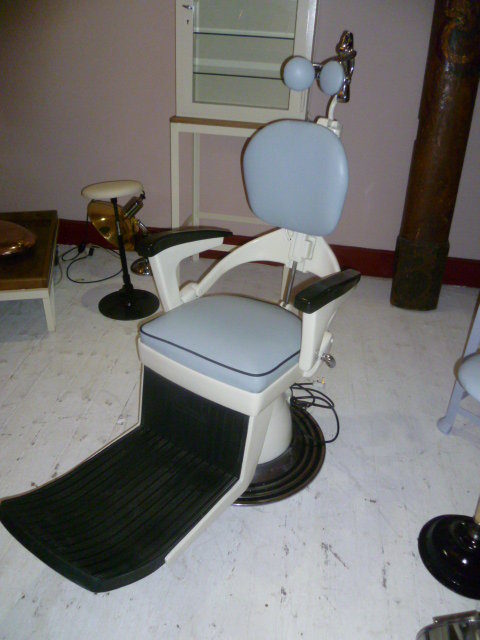
Locate an element on the screen. This screenshot has height=640, width=480. headrest is located at coordinates (302, 70), (332, 77).